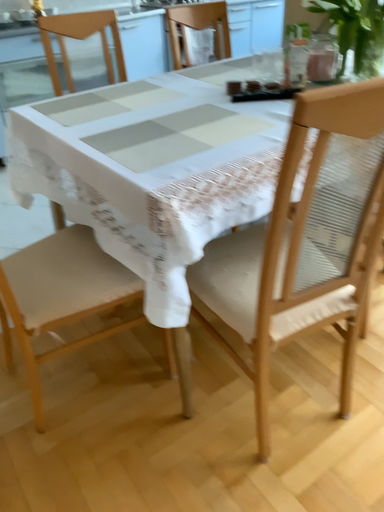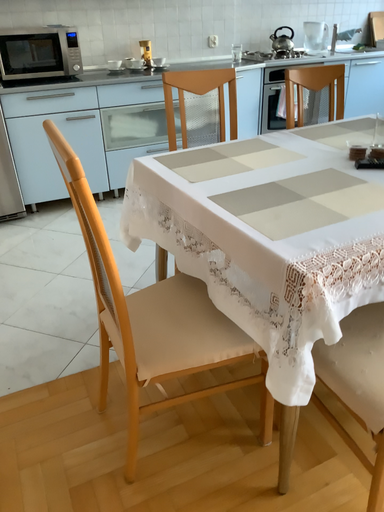
Question: Which way did the camera rotate in the video?

Choices:
 (A) rotated left
 (B) rotated right

Answer: (A)